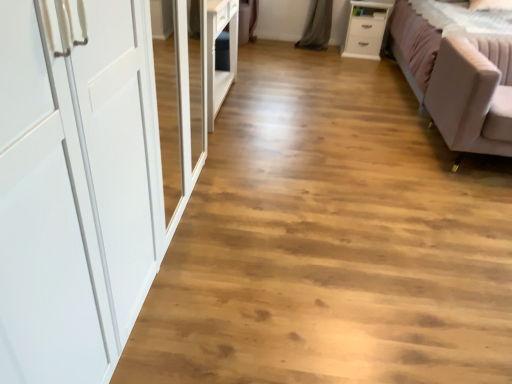
Locate an element on the screen. This screenshot has width=512, height=384. free spot above matte white wardrobe at left (from a real-world perspective) is located at coordinates (349, 168).